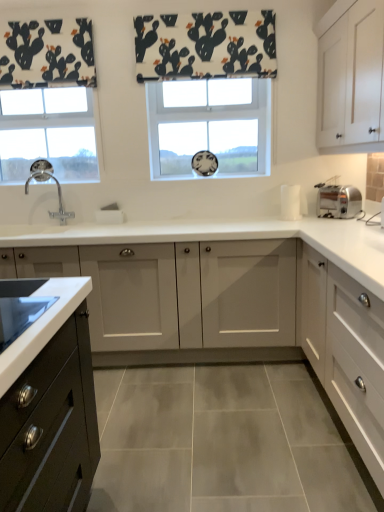
The image size is (384, 512). Describe the element at coordinates (165, 305) in the screenshot. I see `white matte cabinet at center, the third cabinetry ordered from the bottom` at that location.

The height and width of the screenshot is (512, 384). What do you see at coordinates (233, 315) in the screenshot?
I see `white matte cabinet at center, marked as the third cabinetry in a top-to-bottom arrangement` at bounding box center [233, 315].

Image resolution: width=384 pixels, height=512 pixels. Describe the element at coordinates (48, 133) in the screenshot. I see `clear glass window at left, placed as the 1th window when sorted from left to right` at that location.

Where is `white fabric with cactus print at upper center`? white fabric with cactus print at upper center is located at coordinates (205, 45).

What is the approximate height of polished chrome faucet at left?

polished chrome faucet at left is 13.82 inches in height.

The width and height of the screenshot is (384, 512). I want to click on white matte cabinet at center, the third cabinetry ordered from the bottom, so click(165, 305).

Is silver metallic toaster at right positioned in front of clear glass window at left, placed as the 1th window when sorted from left to right?

Yes, silver metallic toaster at right is closer to the viewer.

Does silver metallic toaster at right appear on the right side of clear glass window at left, placed as the 1th window when sorted from left to right?

Indeed, silver metallic toaster at right is positioned on the right side of clear glass window at left, placed as the 1th window when sorted from left to right.

From a real-world perspective, which is physically above, silver metallic toaster at right or clear glass window at left, placed as the 1th window when sorted from left to right?

From a 3D spatial view, clear glass window at left, placed as the 1th window when sorted from left to right, is above.

Is silver metallic toaster at right oriented away from clear glass window at left, placed as the 1th window when sorted from left to right?

No.

Based on the photo, from the image's perspective, is white fabric with cactus print at upper center above polished chrome faucet at left?

Indeed, from the image's perspective, white fabric with cactus print at upper center is shown above polished chrome faucet at left.

How much distance is there between white fabric with cactus print at upper center and polished chrome faucet at left?

4.53 feet.

Does white fabric with cactus print at upper center touch polished chrome faucet at left?

No, white fabric with cactus print at upper center is not with polished chrome faucet at left.

Is white fabric with cactus print at upper center thinner than polished chrome faucet at left?

Yes.

Based on the photo, would you say white glass window at center, which is counted as the first window, starting from the right, is to the left or to the right of polished chrome faucet at left in the picture?

Clearly, white glass window at center, which is counted as the first window, starting from the right, is on the right of polished chrome faucet at left in the image.

In order to click on the 2nd window positioned above the polished chrome faucet at left (from a real-world perspective) in this screenshot , I will do `click(209, 126)`.

Which is less distant, [191,90] or [36,180]?

A: The point [36,180] is closer to the camera.

Considering the sizes of objects white matte cabinet at center, marked as the third cabinetry in a top-to-bottom arrangement, and white matte cabinet at upper right, the 1th cabinetry when ordered from top to bottom, in the image provided, who is shorter, white matte cabinet at center, marked as the third cabinetry in a top-to-bottom arrangement, or white matte cabinet at upper right, the 1th cabinetry when ordered from top to bottom,?

white matte cabinet at upper right, the 1th cabinetry when ordered from top to bottom, is shorter.

From a real-world perspective, is white matte cabinet at center, marked as the third cabinetry in a top-to-bottom arrangement, located higher than white matte cabinet at upper right, acting as the fourth cabinetry starting from the bottom?

No, from a real-world perspective, white matte cabinet at center, marked as the third cabinetry in a top-to-bottom arrangement, is not on top of white matte cabinet at upper right, acting as the fourth cabinetry starting from the bottom.

Considering the relative sizes of white matte cabinet at center, marked as the third cabinetry in a top-to-bottom arrangement, and white matte cabinet at upper right, the 1th cabinetry when ordered from top to bottom, in the image provided, is white matte cabinet at center, marked as the third cabinetry in a top-to-bottom arrangement, bigger than white matte cabinet at upper right, the 1th cabinetry when ordered from top to bottom,?

Correct, white matte cabinet at center, marked as the third cabinetry in a top-to-bottom arrangement, is larger in size than white matte cabinet at upper right, the 1th cabinetry when ordered from top to bottom.

Identify the location of cabinetry that is the 2nd one below the white matte cabinet at upper right, the 1th cabinetry when ordered from top to bottom (from a real-world perspective). (233, 315).

From the picture: From a real-world perspective, is white matte cabinet at center, marked as the third cabinetry in a top-to-bottom arrangement, on top of white glass window at center, which is counted as the first window, starting from the right?

Incorrect, from a real-world perspective, white matte cabinet at center, marked as the third cabinetry in a top-to-bottom arrangement, is lower than white glass window at center, which is counted as the first window, starting from the right.

Which of these two, white matte cabinet at center, marked as the third cabinetry in a top-to-bottom arrangement, or white glass window at center, which is counted as the first window, starting from the right, stands shorter?

white glass window at center, which is counted as the first window, starting from the right.

In the scene shown: Considering the relative positions of white matte cabinet at center, which appears as the 2th cabinetry when ordered from the bottom, and white glass window at center, the 2th window from the left, in the image provided, is white matte cabinet at center, which appears as the 2th cabinetry when ordered from the bottom, to the left of white glass window at center, the 2th window from the left, from the viewer's perspective?

Yes.

From the image's perspective, relative to white glass window at center, the 2th window from the left, is white matte cabinet at center, which appears as the 2th cabinetry when ordered from the bottom, above or below?

From the image's perspective, white matte cabinet at center, which appears as the 2th cabinetry when ordered from the bottom, appears below white glass window at center, the 2th window from the left.

Are white matte cabinet at center, the third cabinetry ordered from the bottom, and polished chrome faucet at left beside each other?

white matte cabinet at center, the third cabinetry ordered from the bottom, is not next to polished chrome faucet at left, and they're not touching.

Is white matte cabinet at center, the third cabinetry ordered from the bottom, not within polished chrome faucet at left?

That's correct, white matte cabinet at center, the third cabinetry ordered from the bottom, is outside of polished chrome faucet at left.

From a real-world perspective, is white matte cabinet at center, the third cabinetry ordered from the bottom, over polished chrome faucet at left?

Actually, white matte cabinet at center, the third cabinetry ordered from the bottom, is physically below polished chrome faucet at left in the real world.

Does point (135, 258) lie behind point (25, 193)?

No, (135, 258) is closer to viewer.

From a real-world perspective, who is located lower, white fabric with cactus print at upper center or white matte cabinet at center, marked as the third cabinetry in a top-to-bottom arrangement?

white matte cabinet at center, marked as the third cabinetry in a top-to-bottom arrangement, is physically lower.

Considering the relative sizes of white fabric with cactus print at upper center and white matte cabinet at center, marked as the third cabinetry in a top-to-bottom arrangement, in the image provided, is white fabric with cactus print at upper center thinner than white matte cabinet at center, marked as the third cabinetry in a top-to-bottom arrangement,?

Correct, the width of white fabric with cactus print at upper center is less than that of white matte cabinet at center, marked as the third cabinetry in a top-to-bottom arrangement.

There is a white fabric with cactus print at upper center. At what (x,y) coordinates should I click in order to perform the action: click on the 3rd cabinetry below it (from the image's perspective). Please return your answer as a coordinate pair (x, y). Looking at the image, I should click on (233, 315).

Is white fabric with cactus print at upper center taller or shorter than white matte cabinet at center, which appears as the 2th cabinetry when ordered from the bottom?

Considering their sizes, white fabric with cactus print at upper center has less height than white matte cabinet at center, which appears as the 2th cabinetry when ordered from the bottom.

Locate an element on the screen. Image resolution: width=384 pixels, height=512 pixels. toaster directly beneath the clear glass window at left, marked as the 2th window in a right-to-left arrangement (from a real-world perspective) is located at coordinates (338, 201).

Where is `tap lying behind the white fabric with cactus print at upper center`? tap lying behind the white fabric with cactus print at upper center is located at coordinates (58, 192).

When comparing their distances from white matte cabinet at right, the 1th cabinetry in the bottom-to-top sequence, does polished chrome faucet at left or silver metallic toaster at right seem further?

Among the two, polished chrome faucet at left is located further to white matte cabinet at right, the 1th cabinetry in the bottom-to-top sequence.

Estimate the real-world distances between objects in this image. Which object is further from white matte cabinet at center, marked as the third cabinetry in a top-to-bottom arrangement, white matte cabinet at upper right, acting as the fourth cabinetry starting from the bottom, or white glass window at center, which is counted as the first window, starting from the right?

The object further to white matte cabinet at center, marked as the third cabinetry in a top-to-bottom arrangement, is white matte cabinet at upper right, acting as the fourth cabinetry starting from the bottom.

Considering their positions, is white glass window at center, which is counted as the first window, starting from the right, positioned closer to white matte cabinet at center, the 2th cabinetry in the top-to-bottom sequence, than white fabric with cactus print at upper center?

white glass window at center, which is counted as the first window, starting from the right.

Considering their positions, is white matte cabinet at center, the third cabinetry ordered from the bottom, positioned further to white fabric with cactus print at upper center than clear glass window at left, placed as the 1th window when sorted from left to right?

white matte cabinet at center, the third cabinetry ordered from the bottom, is positioned further to the anchor white fabric with cactus print at upper center.

Estimate the real-world distances between objects in this image. Which object is closer to polished chrome faucet at left, white matte cabinet at upper right, acting as the fourth cabinetry starting from the bottom, or silver metallic toaster at right?

silver metallic toaster at right lies closer to polished chrome faucet at left than the other object.

Based on their spatial positions, is white fabric with cactus print at upper center or white matte cabinet at center, the third cabinetry ordered from the bottom, closer to white matte cabinet at center, marked as the third cabinetry in a top-to-bottom arrangement?

Among the two, white matte cabinet at center, the third cabinetry ordered from the bottom, is located nearer to white matte cabinet at center, marked as the third cabinetry in a top-to-bottom arrangement.

Estimate the real-world distances between objects in this image. Which object is further from white glass window at center, which is counted as the first window, starting from the right, clear glass window at left, placed as the 1th window when sorted from left to right, or white matte cabinet at center, the third cabinetry ordered from the bottom?

white matte cabinet at center, the third cabinetry ordered from the bottom, is positioned further to the anchor white glass window at center, which is counted as the first window, starting from the right.

Estimate the real-world distances between objects in this image. Which object is closer to white fabric with cactus print at upper center, white matte cabinet at center, the 2th cabinetry in the top-to-bottom sequence, or silver metallic toaster at right?

Based on the image, silver metallic toaster at right appears to be nearer to white fabric with cactus print at upper center.

Where is `cabinetry that lies between white matte cabinet at upper right, acting as the fourth cabinetry starting from the bottom, and white matte cabinet at center, marked as the third cabinetry in a top-to-bottom arrangement, from top to bottom`? This screenshot has width=384, height=512. cabinetry that lies between white matte cabinet at upper right, acting as the fourth cabinetry starting from the bottom, and white matte cabinet at center, marked as the third cabinetry in a top-to-bottom arrangement, from top to bottom is located at coordinates (165, 305).

Image resolution: width=384 pixels, height=512 pixels. I want to click on toaster located between clear glass window at left, placed as the 1th window when sorted from left to right, and white matte cabinet at upper right, the 1th cabinetry when ordered from top to bottom, in the left-right direction, so click(338, 201).

This screenshot has height=512, width=384. In order to click on window between white glass window at center, which is counted as the first window, starting from the right, and white matte cabinet at center, the third cabinetry ordered from the bottom, from top to bottom in this screenshot , I will do `click(48, 133)`.

Locate an element on the screen. window located between white matte cabinet at center, which appears as the 2th cabinetry when ordered from the bottom, and white glass window at center, which is counted as the first window, starting from the right, in the depth direction is located at coordinates coord(48,133).